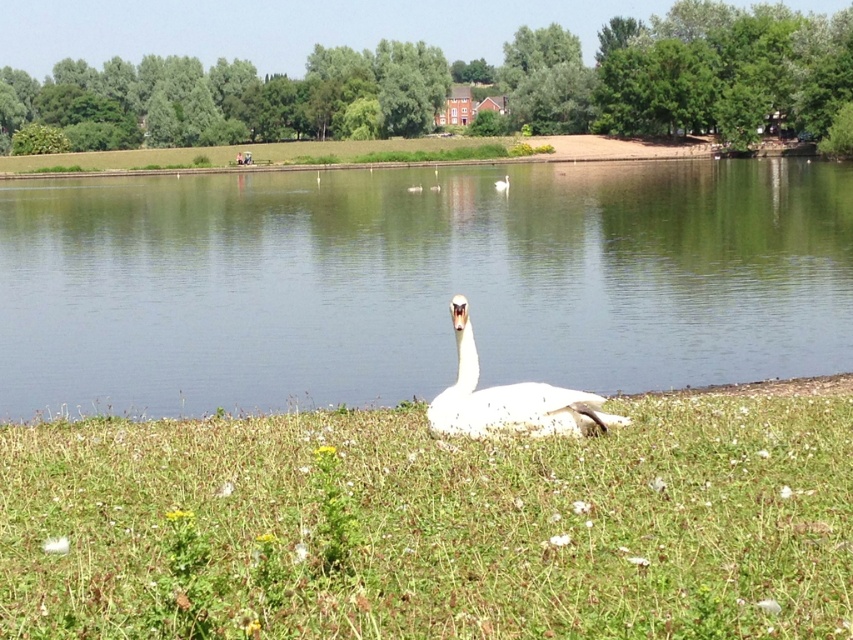
You are a photographer planning to capture the white glossy swan at center and the white soft grass at center in a single frame. Given that your camera has a fixed focal length, which object should you focus on to ensure both are in focus, considering their sizes?

The white soft grass at center has a larger width than the white glossy swan at center, so focusing on the white soft grass at center would ensure both are in focus due to its greater size providing a deeper depth of field.

You are standing at the edge of the lake and want to take a photo. There are two points marked in the scene, point A at coordinates point (515, 483) and point B at coordinates point (497, 179). Which point is closer to you?

Point A at coordinates point (515, 483) is closer to you than point B at coordinates point (497, 179).